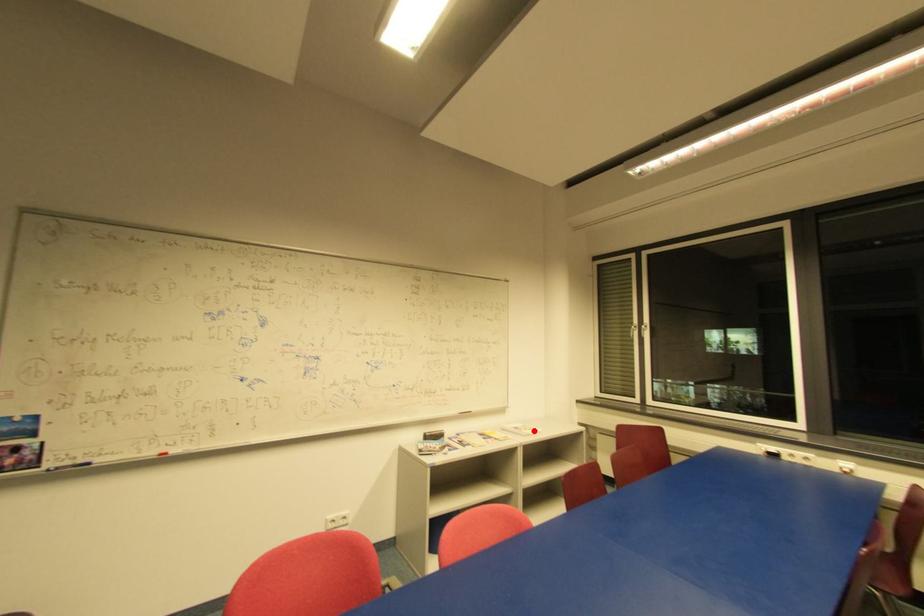
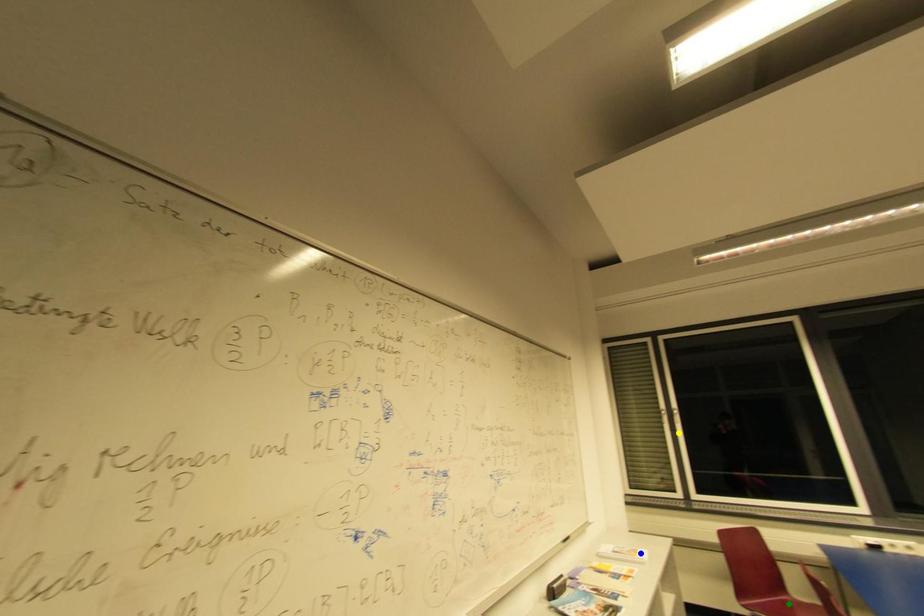
Question: I am providing you with two images of the same scene from different viewpoints. A red point is marked on the first image. You are given multiple points on the second image. Which point in image 2 represents the same 3d spot as the red point in image 1?

Choices:
 (A) blue point
 (B) yellow point
 (C) green point

Answer: (A)